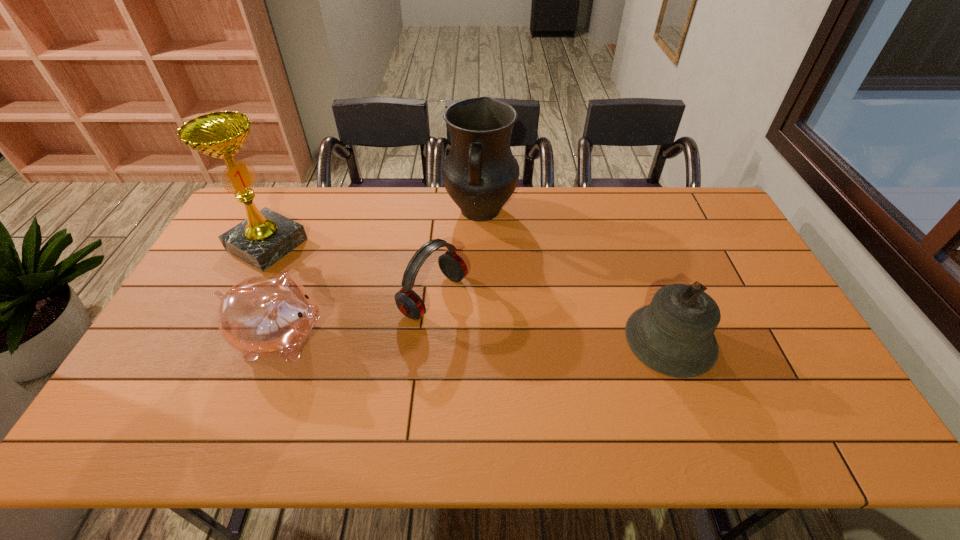
At what (x,y) coordinates should I click in order to perform the action: click on vacant space located on the front-facing side of the award. Please return your answer as a coordinate pair (x, y). Looking at the image, I should click on (356, 292).

Image resolution: width=960 pixels, height=540 pixels. Find the location of `vacant point located on the front-facing side of the award`. vacant point located on the front-facing side of the award is located at coordinates (324, 275).

Find the location of `vacant area situated 0.130m on the front-facing side of the award`. vacant area situated 0.130m on the front-facing side of the award is located at coordinates (323, 274).

Where is `vacant space located on the handle side of the pitcher`? Image resolution: width=960 pixels, height=540 pixels. vacant space located on the handle side of the pitcher is located at coordinates (463, 298).

This screenshot has height=540, width=960. I want to click on free location located 0.080m on the handle side of the pitcher, so click(x=472, y=252).

You are a GUI agent. You are given a task and a screenshot of the screen. Output one action in this format:
    pyautogui.click(x=<x>, y=<y>)
    Task: Click on the free space located on the handle side of the pitcher
    This screenshot has height=540, width=960.
    Given the screenshot: What is the action you would take?
    pyautogui.click(x=470, y=263)

Locate an element on the screen. This screenshot has width=960, height=540. award located at the far edge is located at coordinates (266, 236).

Identify the location of pitcher that is at the far edge. The height and width of the screenshot is (540, 960). (480, 173).

At what (x,y) coordinates should I click in order to perform the action: click on piggy bank at the near edge. Please return your answer as a coordinate pair (x, y). The image size is (960, 540). Looking at the image, I should click on (272, 315).

This screenshot has width=960, height=540. I want to click on bell situated at the near edge, so click(674, 335).